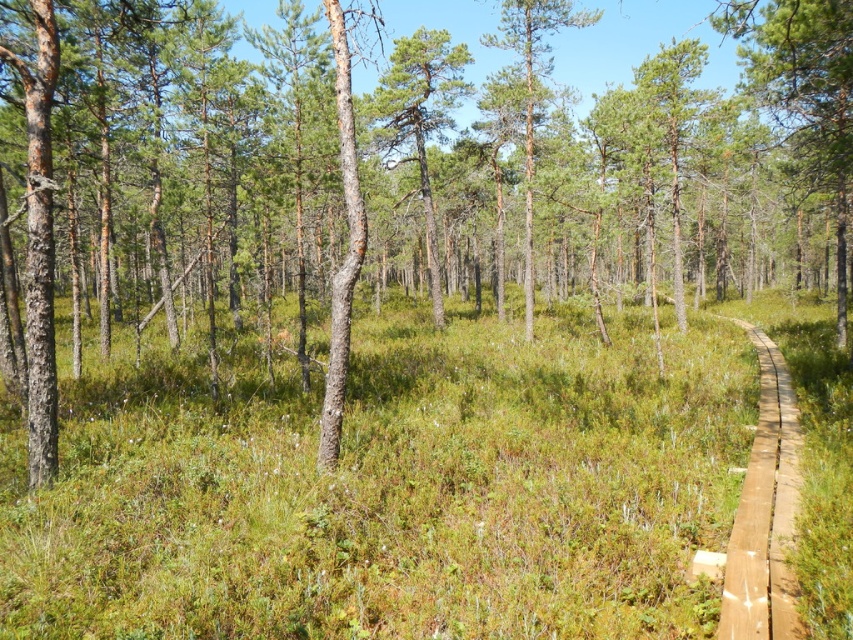
You are standing at the center of a forest clearing. You notice a point marked at coordinates (392, 490). What type of vegetation would you find there?

At point (392, 490), you would find green grassy vegetation.

You are standing at the origin point in the forest. There is a green grassy area at center. Can you walk directly towards the green grassy at center from your current position?

Yes, you can walk directly towards the green grassy at center because it is located at point (392, 490), which is a specific coordinate in the scene.